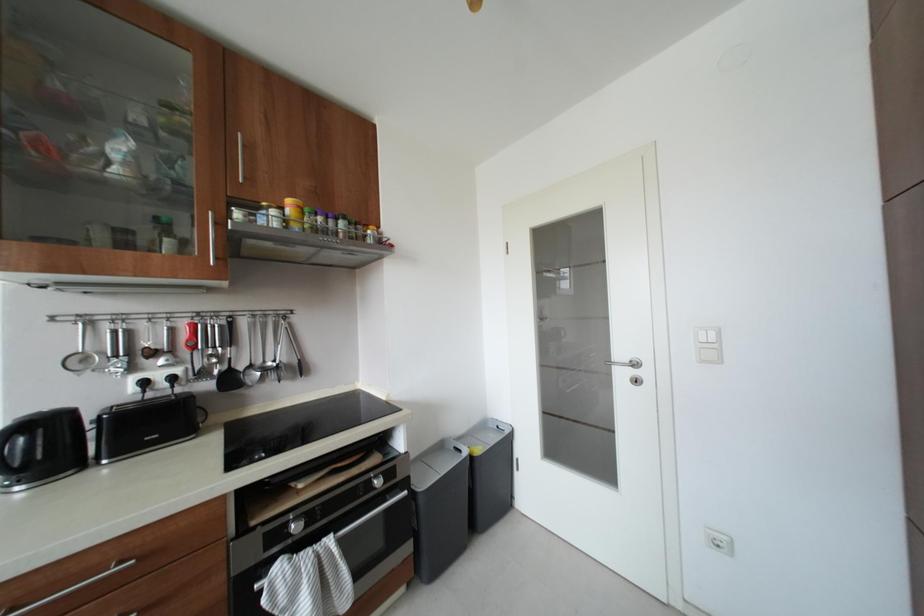
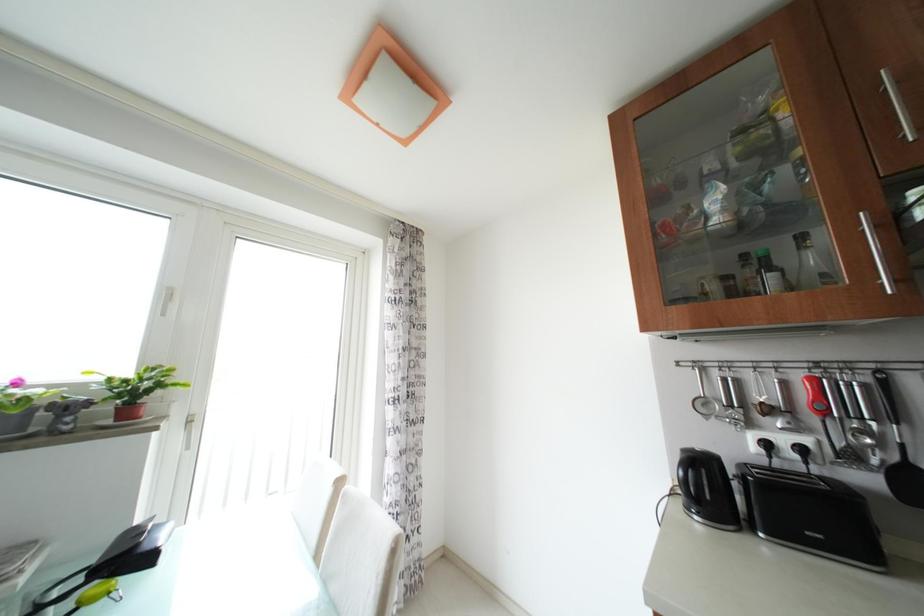
Question: The camera is either moving clockwise (left) or counter-clockwise (right) around the object. The first image is from the beginning of the video and the second image is from the end. Is the camera moving left or right when shooting the video?

Choices:
 (A) Left
 (B) Right

Answer: (B)